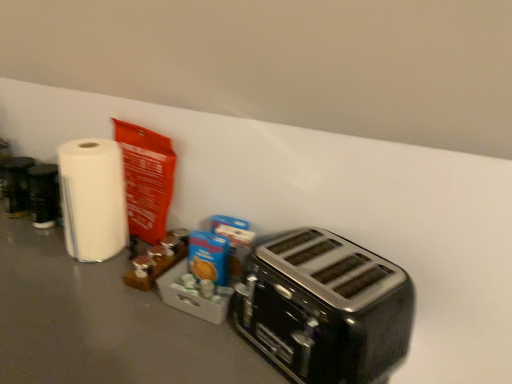
Question: Would you say white glossy paper towel at left is a long distance from black metallic toaster at lower right?

Choices:
 (A) yes
 (B) no

Answer: (B)

Question: Is white glossy paper towel at left smaller than black metallic toaster at lower right?

Choices:
 (A) no
 (B) yes

Answer: (B)

Question: Is white glossy paper towel at left behind black metallic toaster at lower right?

Choices:
 (A) yes
 (B) no

Answer: (A)

Question: Would you say black metallic toaster at lower right is part of white glossy paper towel at left's contents?

Choices:
 (A) yes
 (B) no

Answer: (B)

Question: From the image's perspective, does white glossy paper towel at left appear higher than black metallic toaster at lower right?

Choices:
 (A) no
 (B) yes

Answer: (B)

Question: Is white glossy paper towel at left looking in the opposite direction of black metallic toaster at lower right?

Choices:
 (A) yes
 (B) no

Answer: (B)

Question: Considering the relative positions of black metallic toaster at lower right and white glossy paper towel at left in the image provided, is black metallic toaster at lower right to the right of white glossy paper towel at left from the viewer's perspective?

Choices:
 (A) yes
 (B) no

Answer: (A)

Question: Is black metallic toaster at lower right to the left of white glossy paper towel at left from the viewer's perspective?

Choices:
 (A) no
 (B) yes

Answer: (A)

Question: Is black metallic toaster at lower right shorter than white glossy paper towel at left?

Choices:
 (A) yes
 (B) no

Answer: (A)

Question: Considering the relative positions of black metallic toaster at lower right and white glossy paper towel at left in the image provided, is black metallic toaster at lower right in front of white glossy paper towel at left?

Choices:
 (A) no
 (B) yes

Answer: (B)

Question: Does black metallic toaster at lower right have a larger size compared to white glossy paper towel at left?

Choices:
 (A) no
 (B) yes

Answer: (B)

Question: From the image's perspective, is black metallic toaster at lower right over white glossy paper towel at left?

Choices:
 (A) yes
 (B) no

Answer: (B)

Question: Is white glossy paper towel at left wider or thinner than black metallic toaster at lower right?

Choices:
 (A) thin
 (B) wide

Answer: (A)